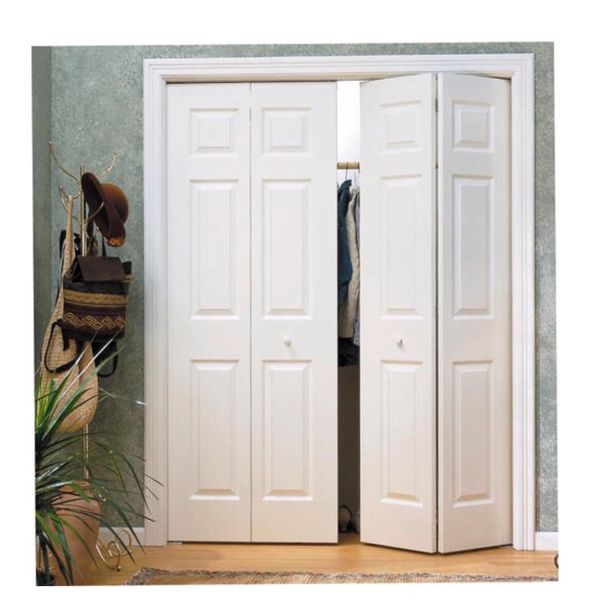
The image size is (600, 600). I want to click on knob, so click(283, 339).